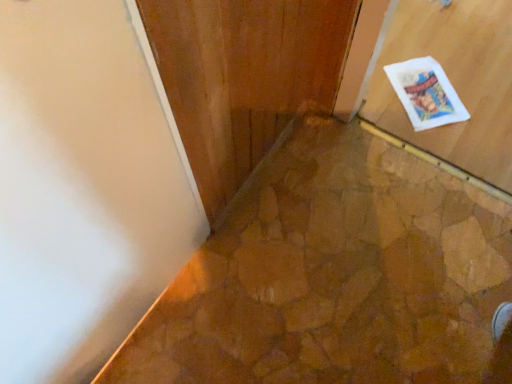
Question: Considering the positions of matte wood door at upper right and white paper postcard at upper right in the image, is matte wood door at upper right taller or shorter than white paper postcard at upper right?

Choices:
 (A) tall
 (B) short

Answer: (A)

Question: From a real-world perspective, is matte wood door at upper right positioned above or below white paper postcard at upper right?

Choices:
 (A) below
 (B) above

Answer: (B)

Question: In terms of width, does matte wood door at upper right look wider or thinner when compared to white paper postcard at upper right?

Choices:
 (A) thin
 (B) wide

Answer: (A)

Question: Considering the positions of white paper postcard at upper right and matte wood door at upper right in the image, is white paper postcard at upper right taller or shorter than matte wood door at upper right?

Choices:
 (A) tall
 (B) short

Answer: (B)

Question: Relative to matte wood door at upper right, is white paper postcard at upper right in front or behind?

Choices:
 (A) front
 (B) behind

Answer: (B)

Question: Do you think white paper postcard at upper right is within matte wood door at upper right, or outside of it?

Choices:
 (A) outside
 (B) inside

Answer: (A)

Question: From the image's perspective, is white paper postcard at upper right positioned above or below matte wood door at upper right?

Choices:
 (A) above
 (B) below

Answer: (A)